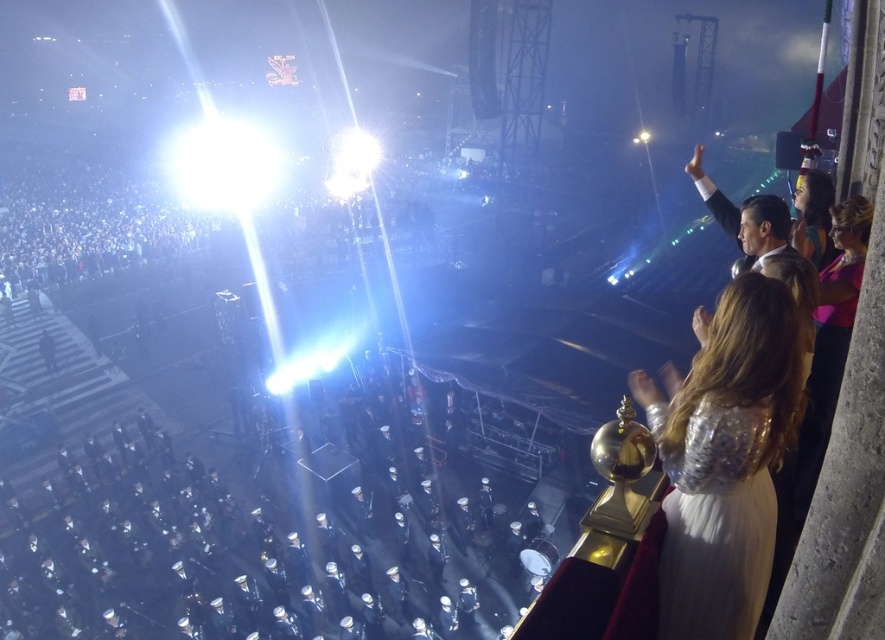
Who is lower down, shiny silver dress at upper right or silver sequined dress at right?

silver sequined dress at right

Between shiny silver dress at upper right and silver sequined dress at right, which one is positioned higher?

Positioned higher is shiny silver dress at upper right.

Does point (716, 387) come behind point (713, 477)?

No, it is not.

You are a GUI agent. You are given a task and a screenshot of the screen. Output one action in this format:
    pyautogui.click(x=<x>, y=<y>)
    Task: Click on the shiny silver dress at upper right
    This screenshot has width=885, height=640.
    Given the screenshot: What is the action you would take?
    pyautogui.click(x=725, y=458)